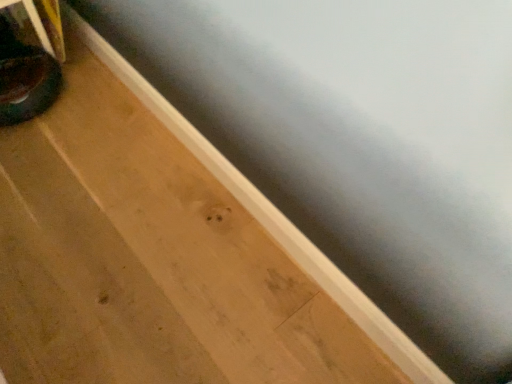
What do you see at coordinates (28, 86) in the screenshot? I see `shiny brown shoe at left` at bounding box center [28, 86].

Identify the location of shiny brown shoe at left. Image resolution: width=512 pixels, height=384 pixels. (x=28, y=86).

Where is `shiny brown shoe at left`? shiny brown shoe at left is located at coordinates (28, 86).